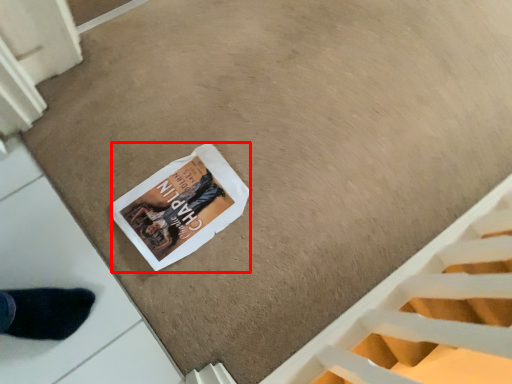
Question: From the image's perspective, where is magazine (annotated by the red box) located relative to stairwell?

Choices:
 (A) above
 (B) below

Answer: (A)